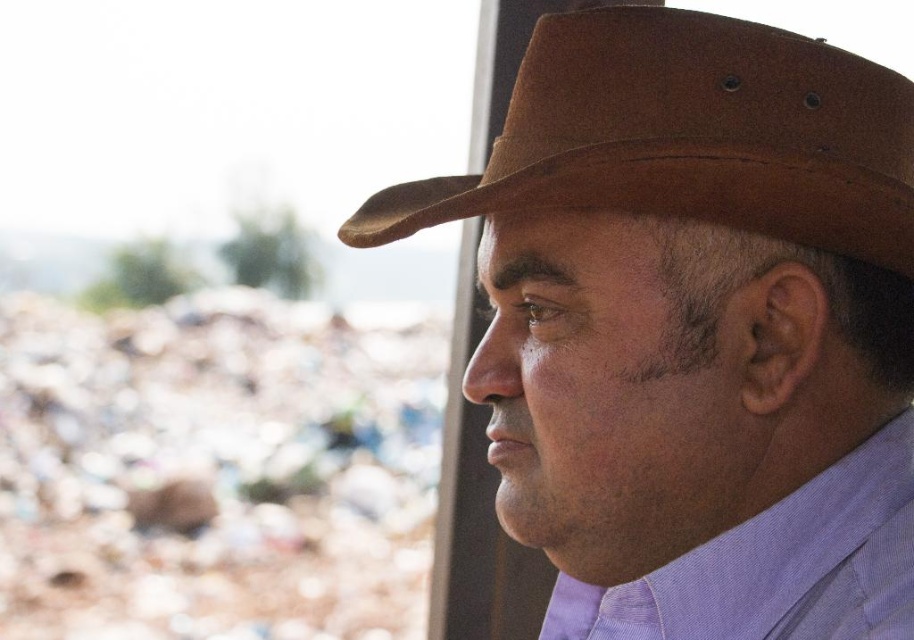
Can you confirm if brown leather hat at upper right is positioned to the left of purple cotton dress shirt at center?

Correct, you'll find brown leather hat at upper right to the left of purple cotton dress shirt at center.

Which is in front, point (593, 262) or point (841, 577)?

Point (593, 262)

The image size is (914, 640). What do you see at coordinates (695, 326) in the screenshot?
I see `brown leather hat at upper right` at bounding box center [695, 326].

Where is `brown leather hat at upper right`? brown leather hat at upper right is located at coordinates (695, 326).

Who is shorter, brown leather hat at upper right or brown suede cowboy hat at upper center?

With less height is brown suede cowboy hat at upper center.

Is point (692, 108) farther from viewer compared to point (843, 253)?

No, it is not.

At what (x,y) coordinates should I click in order to perform the action: click on brown leather hat at upper right. Please return your answer as a coordinate pair (x, y). Looking at the image, I should click on (695, 326).

Can you confirm if brown suede cowboy hat at upper center is wider than purple cotton dress shirt at center?

Correct, the width of brown suede cowboy hat at upper center exceeds that of purple cotton dress shirt at center.

Identify the location of brown suede cowboy hat at upper center. The height and width of the screenshot is (640, 914). (688, 134).

This screenshot has width=914, height=640. I want to click on brown suede cowboy hat at upper center, so click(688, 134).